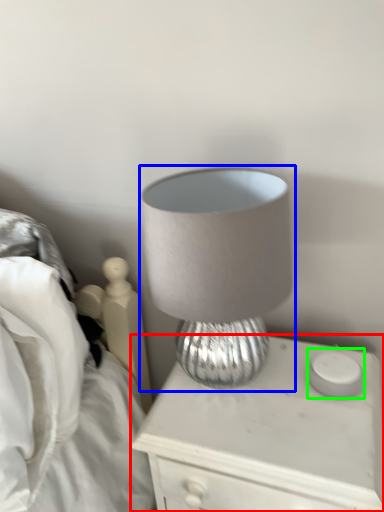
Question: Considering the real-world distances, which object is closest to nightstand (highlighted by a red box)? lamp (highlighted by a blue box) or candle holder (highlighted by a green box).

Choices:
 (A) lamp
 (B) candle holder

Answer: (B)